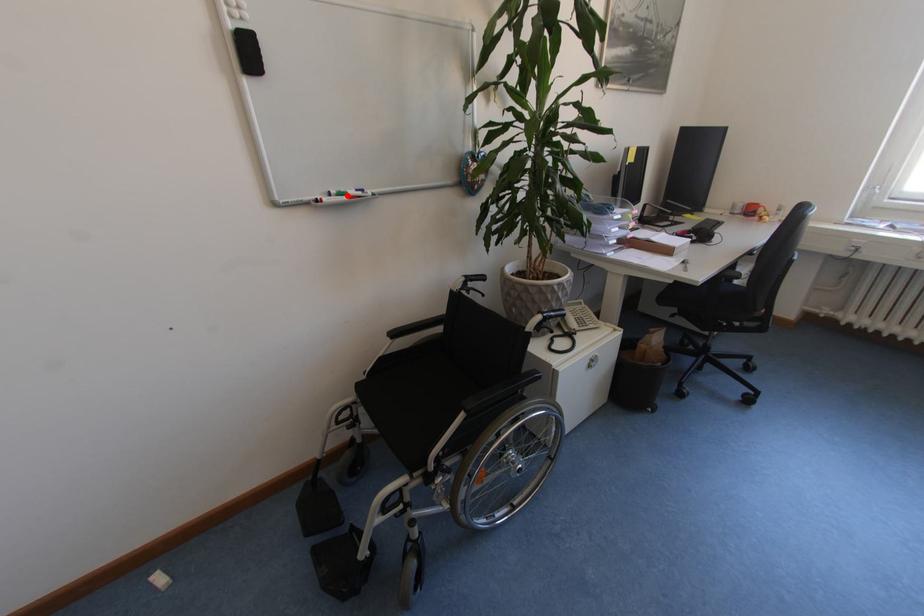
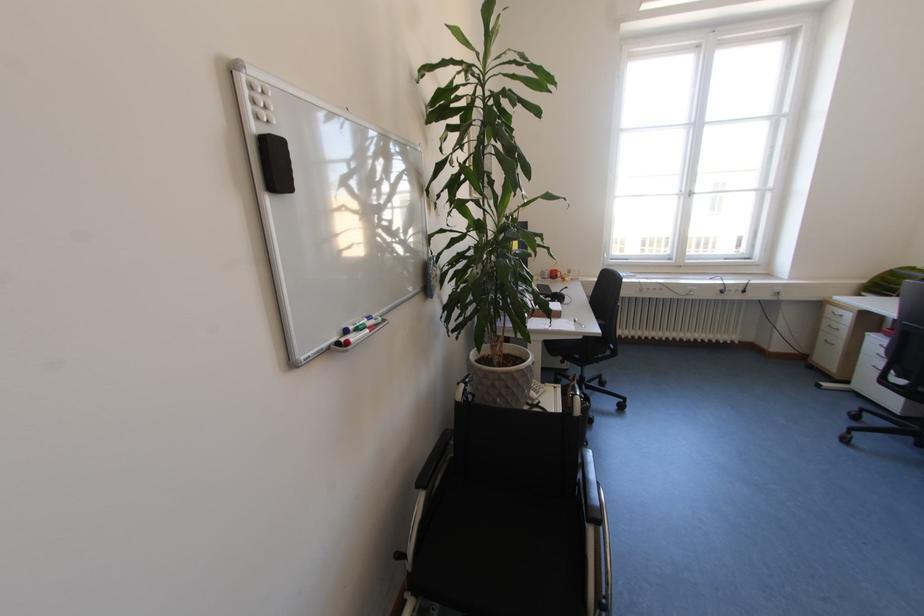
Find the pixel in the second image that matches the highlighted location in the first image.

(366, 330)